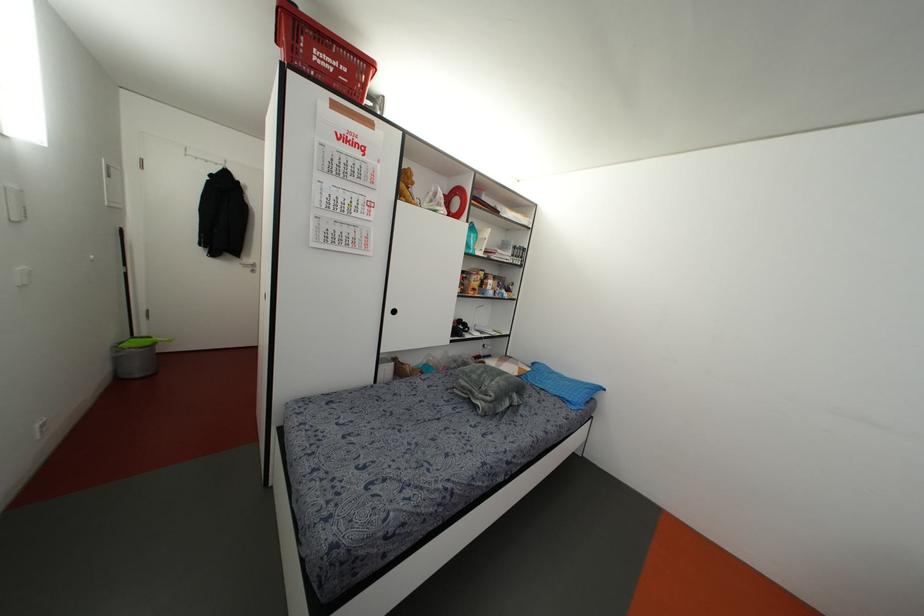
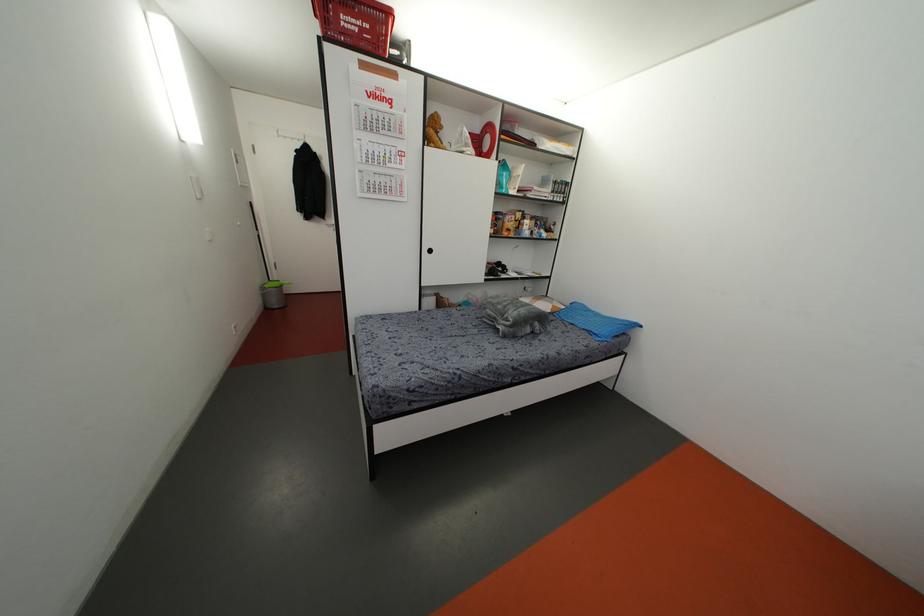
The point at (448, 213) is marked in the first image. Where is the corresponding point in the second image?

(479, 153)